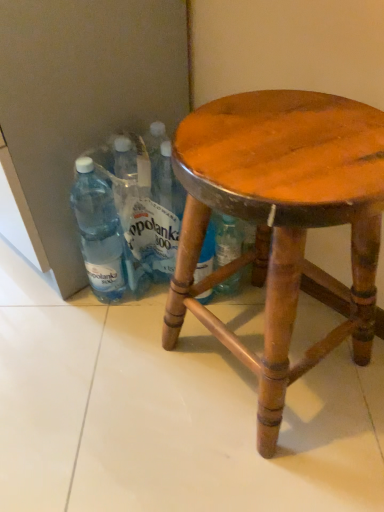
Locate an element on the screen. This screenshot has width=384, height=512. free space in front of transparent plastic bottle at left is located at coordinates (101, 352).